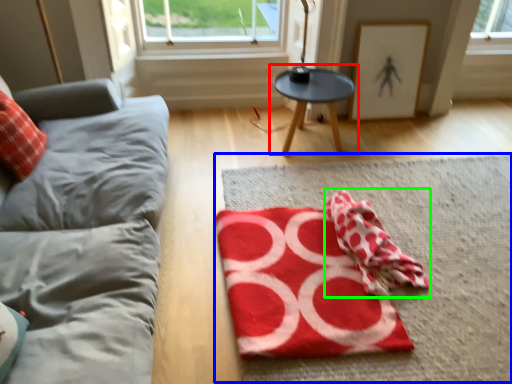
Question: Based on their relative distances, which object is nearer to table (highlighted by a red box)? Choose from mat (highlighted by a blue box) and beach towel (highlighted by a green box).

Choices:
 (A) mat
 (B) beach towel

Answer: (A)